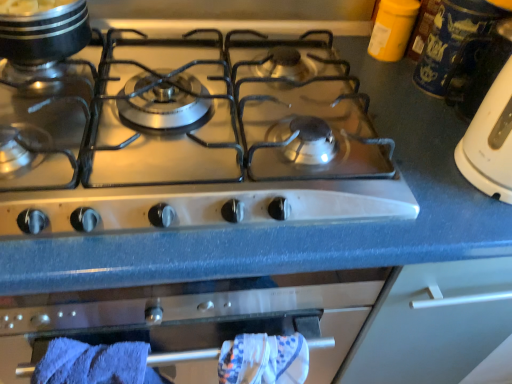
Where is `blue ceramic mug at upper right`? The width and height of the screenshot is (512, 384). blue ceramic mug at upper right is located at coordinates (450, 39).

The width and height of the screenshot is (512, 384). Describe the element at coordinates (45, 34) in the screenshot. I see `shiny metallic pot at upper left` at that location.

Identify the location of satin silver gas stove at center. This screenshot has height=384, width=512. (194, 115).

The image size is (512, 384). Find the location of `blue soft towel at lower left`. blue soft towel at lower left is located at coordinates (95, 364).

Locate an element on the screen. The height and width of the screenshot is (384, 512). blue ceramic mug at upper right is located at coordinates (450, 39).

Considering the sizes of objects blue ceramic mug at upper right and blue soft towel at lower left in the image provided, who is thinner, blue ceramic mug at upper right or blue soft towel at lower left?

blue soft towel at lower left.

Between blue ceramic mug at upper right and blue soft towel at lower left, which one has larger size?

Bigger between the two is blue soft towel at lower left.

From a real-world perspective, is blue ceramic mug at upper right beneath blue soft towel at lower left?

No, from a real-world perspective, blue ceramic mug at upper right is not under blue soft towel at lower left.

Is blue ceramic mug at upper right located outside blue soft towel at lower left?

Indeed, blue ceramic mug at upper right is completely outside blue soft towel at lower left.

Considering the relative sizes of satin silver gas stove at center and shiny metallic pot at upper left in the image provided, is satin silver gas stove at center shorter than shiny metallic pot at upper left?

Yes, satin silver gas stove at center is shorter than shiny metallic pot at upper left.

From the image's perspective, which is below, satin silver gas stove at center or shiny metallic pot at upper left?

satin silver gas stove at center is shown below in the image.

Locate an element on the screen. The width and height of the screenshot is (512, 384). kitchen appliance behind the satin silver gas stove at center is located at coordinates click(x=45, y=34).

From the picture: Is blue soft towel at lower left to the left or to the right of satin silver gas stove at center in the image?

Clearly, blue soft towel at lower left is on the left of satin silver gas stove at center in the image.

Is point (96, 376) positioned before point (391, 176)?

Yes, it is.

Is blue soft towel at lower left closer to camera compared to satin silver gas stove at center?

No, blue soft towel at lower left is further to the viewer.

From the image's perspective, is blue soft towel at lower left located above or below satin silver gas stove at center?

blue soft towel at lower left is situated lower than satin silver gas stove at center in the image.

Does shiny metallic pot at upper left appear on the right side of satin silver gas stove at center?

No, shiny metallic pot at upper left is not to the right of satin silver gas stove at center.

Can you confirm if shiny metallic pot at upper left is thinner than satin silver gas stove at center?

Indeed, shiny metallic pot at upper left has a lesser width compared to satin silver gas stove at center.

Is point (72, 26) closer to viewer compared to point (177, 92)?

That is True.

From the image's perspective, who appears lower, satin silver gas stove at center or blue soft towel at lower left?

From the image's view, blue soft towel at lower left is below.

Can you confirm if satin silver gas stove at center is smaller than blue soft towel at lower left?

No.

Which of these two, satin silver gas stove at center or blue soft towel at lower left, is thinner?

With smaller width is blue soft towel at lower left.

Which object is positioned more to the left, shiny metallic pot at upper left or blue ceramic mug at upper right?

Positioned to the left is shiny metallic pot at upper left.

Is point (72, 19) less distant than point (447, 50)?

Yes, point (72, 19) is in front of point (447, 50).

Is shiny metallic pot at upper left aimed at blue ceramic mug at upper right?

No, shiny metallic pot at upper left is not facing towards blue ceramic mug at upper right.

Is shiny metallic pot at upper left further to the viewer compared to blue ceramic mug at upper right?

No, the depth of shiny metallic pot at upper left is less than that of blue ceramic mug at upper right.

Is satin silver gas stove at center a part of blue ceramic mug at upper right?

No, satin silver gas stove at center is not a part of blue ceramic mug at upper right.

At what (x,y) coordinates should I click in order to perform the action: click on appliance lying on the right of satin silver gas stove at center. Please return your answer as a coordinate pair (x, y). The height and width of the screenshot is (384, 512). Looking at the image, I should click on tap(450, 39).

Can you confirm if blue ceramic mug at upper right is smaller than satin silver gas stove at center?

Correct, blue ceramic mug at upper right occupies less space than satin silver gas stove at center.

Is blue ceramic mug at upper right wider or thinner than satin silver gas stove at center?

In the image, blue ceramic mug at upper right appears to be more narrow than satin silver gas stove at center.

Where is `appliance that is behind the blue soft towel at lower left`? appliance that is behind the blue soft towel at lower left is located at coordinates (x=450, y=39).

Identify the location of gas stove below the shiny metallic pot at upper left (from the image's perspective). (194, 115).

Considering their positions, is shiny metallic pot at upper left positioned further to blue soft towel at lower left than satin silver gas stove at center?

shiny metallic pot at upper left lies further to blue soft towel at lower left than the other object.

When comparing their distances from blue soft towel at lower left, does shiny metallic pot at upper left or blue ceramic mug at upper right seem closer?

shiny metallic pot at upper left.

Looking at the image, which one is located further to shiny metallic pot at upper left, blue soft towel at lower left or blue ceramic mug at upper right?

blue ceramic mug at upper right.

Which object lies nearer to the anchor point blue soft towel at lower left, blue ceramic mug at upper right or shiny metallic pot at upper left?

Among the two, shiny metallic pot at upper left is located nearer to blue soft towel at lower left.

From the image, which object appears to be farther from blue ceramic mug at upper right, blue soft towel at lower left or satin silver gas stove at center?

The object further to blue ceramic mug at upper right is blue soft towel at lower left.

Based on their spatial positions, is satin silver gas stove at center or blue soft towel at lower left further from shiny metallic pot at upper left?

Based on the image, blue soft towel at lower left appears to be further to shiny metallic pot at upper left.

Considering their positions, is blue ceramic mug at upper right positioned closer to blue soft towel at lower left than satin silver gas stove at center?

The object closer to blue soft towel at lower left is satin silver gas stove at center.

From the image, which object appears to be farther from satin silver gas stove at center, blue soft towel at lower left or blue ceramic mug at upper right?

Based on the image, blue ceramic mug at upper right appears to be further to satin silver gas stove at center.

Identify the location of bath towel between shiny metallic pot at upper left and blue ceramic mug at upper right from left to right. The height and width of the screenshot is (384, 512). [95, 364].

Find the location of a particular element. Image resolution: width=512 pixels, height=384 pixels. gas stove located between shiny metallic pot at upper left and blue ceramic mug at upper right in the left-right direction is located at coordinates (194, 115).

Image resolution: width=512 pixels, height=384 pixels. I want to click on gas stove located between blue soft towel at lower left and blue ceramic mug at upper right in the left-right direction, so click(194, 115).

The width and height of the screenshot is (512, 384). What are the coordinates of `gas stove that lies between shiny metallic pot at upper left and blue soft towel at lower left from top to bottom` in the screenshot? It's located at (194, 115).